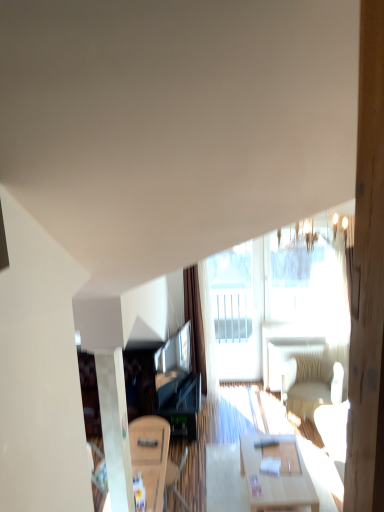
Question: Is transparent glass window at upper center next to transparent glass door at center and touching it?

Choices:
 (A) no
 (B) yes

Answer: (A)

Question: Can you confirm if transparent glass window at upper center is smaller than transparent glass door at center?

Choices:
 (A) no
 (B) yes

Answer: (B)

Question: Can you confirm if transparent glass window at upper center is positioned to the left of transparent glass door at center?

Choices:
 (A) yes
 (B) no

Answer: (B)

Question: Is transparent glass window at upper center positioned beyond the bounds of transparent glass door at center?

Choices:
 (A) yes
 (B) no

Answer: (A)

Question: Is transparent glass window at upper center taller than transparent glass door at center?

Choices:
 (A) yes
 (B) no

Answer: (B)

Question: Based on their sizes in the image, would you say matte black entertainment center at center is bigger or smaller than transparent glass door at center?

Choices:
 (A) small
 (B) big

Answer: (A)

Question: From a real-world perspective, is matte black entertainment center at center above or below transparent glass door at center?

Choices:
 (A) above
 (B) below

Answer: (B)

Question: Based on their positions, is matte black entertainment center at center located to the left or right of transparent glass door at center?

Choices:
 (A) right
 (B) left

Answer: (B)

Question: Considering their positions, is matte black entertainment center at center located in front of or behind transparent glass door at center?

Choices:
 (A) front
 (B) behind

Answer: (A)

Question: From the image's perspective, relative to brown fabric curtain at center, is white fabric armchair at right above or below?

Choices:
 (A) above
 (B) below

Answer: (B)

Question: From a real-world perspective, is white fabric armchair at right physically located above or below brown fabric curtain at center?

Choices:
 (A) below
 (B) above

Answer: (A)

Question: Is white fabric armchair at right bigger or smaller than brown fabric curtain at center?

Choices:
 (A) small
 (B) big

Answer: (A)

Question: Does point (322, 384) appear closer or farther from the camera than point (195, 334)?

Choices:
 (A) closer
 (B) farther

Answer: (A)

Question: Looking at the image, does transparent glass door at center seem bigger or smaller compared to brown fabric curtain at center?

Choices:
 (A) small
 (B) big

Answer: (A)

Question: Considering the positions of transparent glass door at center and brown fabric curtain at center in the image, is transparent glass door at center wider or thinner than brown fabric curtain at center?

Choices:
 (A) wide
 (B) thin

Answer: (B)